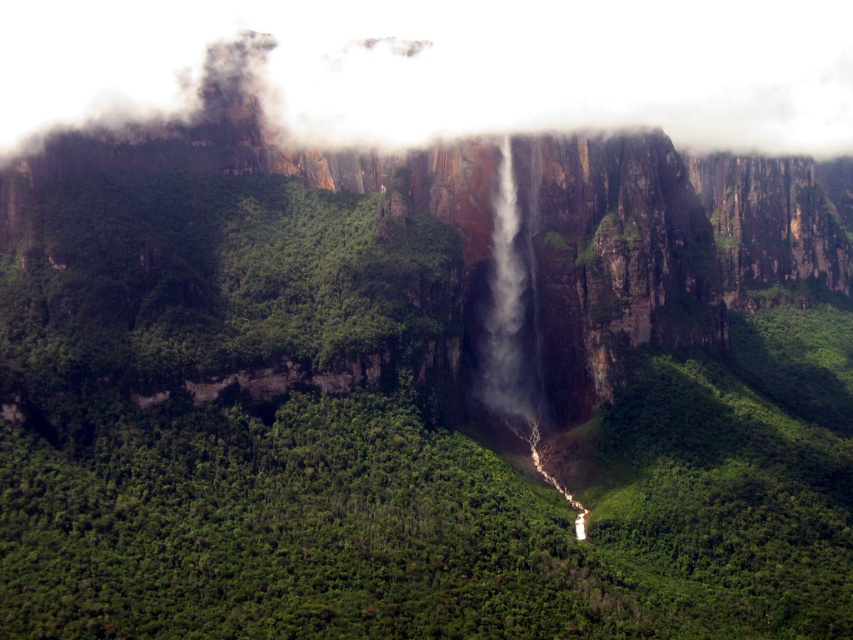
Between white fog at upper center and white misty waterfall at center, which one is positioned lower?

Positioned lower is white misty waterfall at center.

Does white fog at upper center appear over white misty waterfall at center?

Yes, white fog at upper center is above white misty waterfall at center.

Where is `white fog at upper center`? The width and height of the screenshot is (853, 640). white fog at upper center is located at coordinates tap(450, 67).